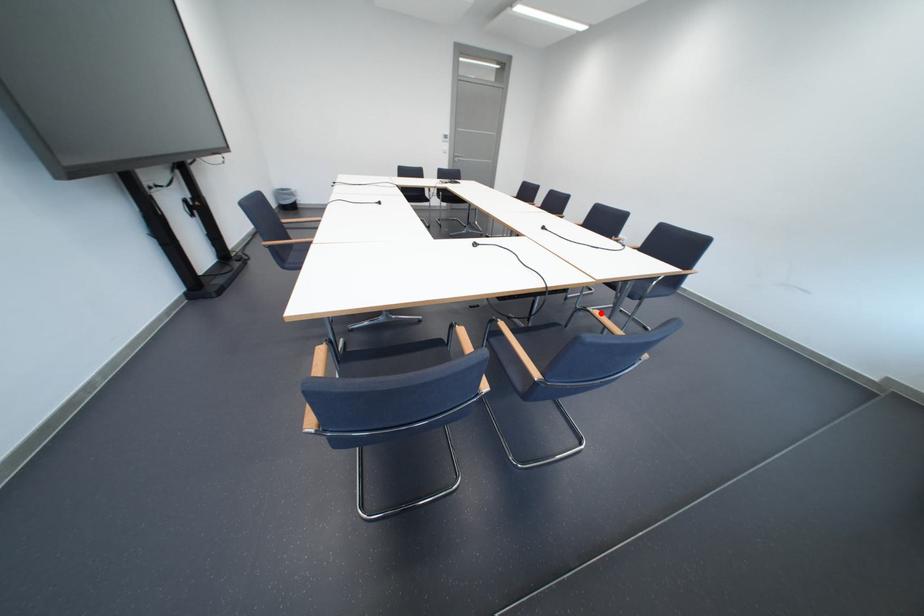
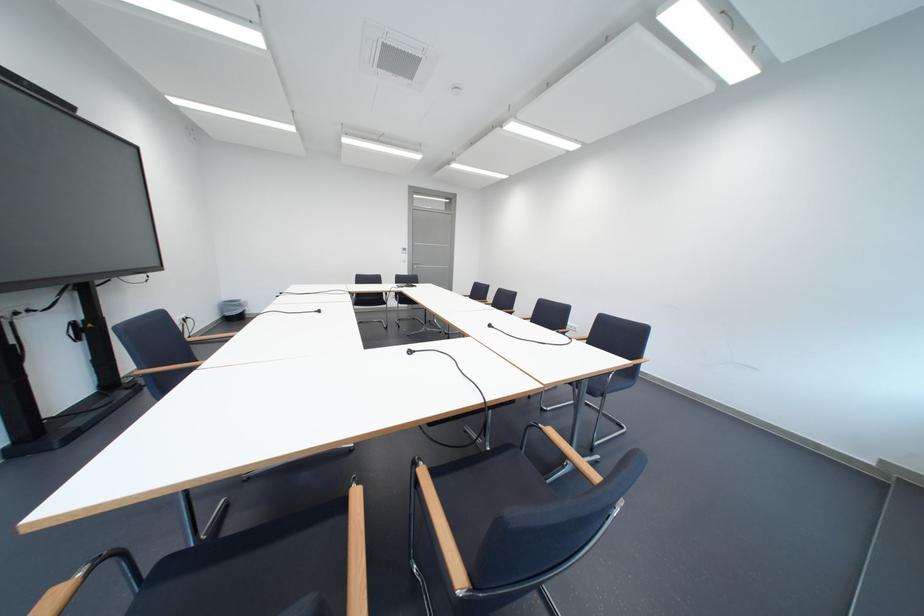
Where in the second image is the point corresponding to the highlighted location from the first image?

(553, 431)